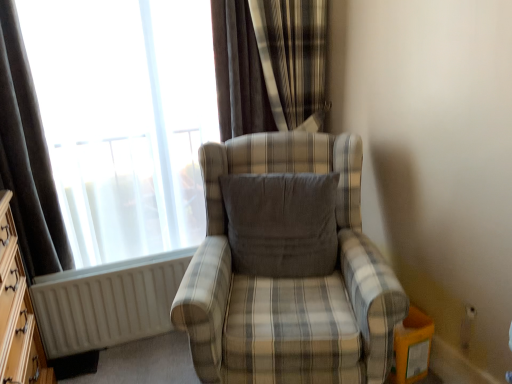
The height and width of the screenshot is (384, 512). Describe the element at coordinates (270, 65) in the screenshot. I see `velvet-like brown curtain at upper center, which ranks as the second curtain in left-to-right order` at that location.

The image size is (512, 384). What are the coordinates of `dark fabric curtain at left, acting as the 1th curtain starting from the left` in the screenshot? It's located at (28, 157).

What do you see at coordinates (106, 302) in the screenshot?
I see `white matte radiator at lower left` at bounding box center [106, 302].

Measure the distance between point (231,291) and camera.

A distance of 1.74 meters exists between point (231,291) and camera.

What is the approximate width of gray fabric pillow at center?

8.17 inches.

Locate an element on the screen. This screenshot has height=384, width=512. velvet-like brown curtain at upper center, positioned as the first curtain in right-to-left order is located at coordinates (270, 65).

Which is farther, [251,197] or [291,57]?

The point [291,57] is more distant.

From a real-world perspective, is gray fabric pillow at center physically located above or below velvet-like brown curtain at upper center, positioned as the first curtain in right-to-left order?

gray fabric pillow at center is situated lower than velvet-like brown curtain at upper center, positioned as the first curtain in right-to-left order, in the real world.

Is gray fabric pillow at center in front of or behind velvet-like brown curtain at upper center, which ranks as the second curtain in left-to-right order, in the image?

In the image, gray fabric pillow at center appears in front of velvet-like brown curtain at upper center, which ranks as the second curtain in left-to-right order.

Based on the photo, would you consider matte glass window at upper left to be distant from gray fabric pillow at center?

matte glass window at upper left is near gray fabric pillow at center, not far away.

Who is more distant, matte glass window at upper left or gray fabric pillow at center?

matte glass window at upper left is more distant.

Does matte glass window at upper left have a greater width compared to gray fabric pillow at center?

No, matte glass window at upper left is not wider than gray fabric pillow at center.

Considering the positions of objects plaid fabric chair at center and dark fabric curtain at left, which ranks as the second curtain in right-to-left order, in the image provided, who is more to the right, plaid fabric chair at center or dark fabric curtain at left, which ranks as the second curtain in right-to-left order,?

plaid fabric chair at center.

Which is less distant, (307, 299) or (7, 168)?

Clearly, point (307, 299) is closer to the camera than point (7, 168).

Which of these two, plaid fabric chair at center or dark fabric curtain at left, acting as the 1th curtain starting from the left, is smaller?

dark fabric curtain at left, acting as the 1th curtain starting from the left.

From the image's perspective, is plaid fabric chair at center below dark fabric curtain at left, acting as the 1th curtain starting from the left?

Yes, from the image's perspective, plaid fabric chair at center is beneath dark fabric curtain at left, acting as the 1th curtain starting from the left.

Is matte glass window at upper left positioned far away from velvet-like brown curtain at upper center, which ranks as the second curtain in left-to-right order?

That's not correct — matte glass window at upper left is a little close to velvet-like brown curtain at upper center, which ranks as the second curtain in left-to-right order.

Identify the location of window located below the velvet-like brown curtain at upper center, positioned as the first curtain in right-to-left order (from the image's perspective). (141, 113).

Could you tell me if matte glass window at upper left is facing velvet-like brown curtain at upper center, positioned as the first curtain in right-to-left order?

No, matte glass window at upper left is not oriented towards velvet-like brown curtain at upper center, positioned as the first curtain in right-to-left order.

How different are the orientations of matte glass window at upper left and velvet-like brown curtain at upper center, positioned as the first curtain in right-to-left order, in degrees?

matte glass window at upper left and velvet-like brown curtain at upper center, positioned as the first curtain in right-to-left order, are facing 0.787 degrees away from each other.

Considering the positions of points (254, 39) and (151, 117), is point (254, 39) closer to camera compared to point (151, 117)?

Yes, point (254, 39) is closer to viewer.

Is velvet-like brown curtain at upper center, positioned as the first curtain in right-to-left order, aimed at matte glass window at upper left?

No, velvet-like brown curtain at upper center, positioned as the first curtain in right-to-left order, is not turned towards matte glass window at upper left.

Is the position of velvet-like brown curtain at upper center, which ranks as the second curtain in left-to-right order, less distant than that of matte glass window at upper left?

No, the depth of velvet-like brown curtain at upper center, which ranks as the second curtain in left-to-right order, is greater than that of matte glass window at upper left.

Is point (4, 338) farther from camera compared to point (161, 275)?

No.

In the scene shown: Which object is positioned more to the right, wooden dresser at left or white matte radiator at lower left?

white matte radiator at lower left.

How distant is wooden dresser at left from white matte radiator at lower left?

wooden dresser at left and white matte radiator at lower left are 13.28 inches apart from each other.

Is wooden dresser at left turned away from white matte radiator at lower left?

No, wooden dresser at left is not facing the opposite direction of white matte radiator at lower left.

Considering the points (292, 184) and (19, 187), which point is in front, point (292, 184) or point (19, 187)?

The point (292, 184) is closer.

Which object is positioned more to the right, gray fabric pillow at center or dark fabric curtain at left, which ranks as the second curtain in right-to-left order?

From the viewer's perspective, gray fabric pillow at center appears more on the right side.

Is gray fabric pillow at center closer to camera compared to dark fabric curtain at left, acting as the 1th curtain starting from the left?

No, gray fabric pillow at center is behind dark fabric curtain at left, acting as the 1th curtain starting from the left.

Considering the relative sizes of gray fabric pillow at center and dark fabric curtain at left, acting as the 1th curtain starting from the left, in the image provided, is gray fabric pillow at center wider than dark fabric curtain at left, acting as the 1th curtain starting from the left,?

Indeed, gray fabric pillow at center has a greater width compared to dark fabric curtain at left, acting as the 1th curtain starting from the left.

Identify the location of curtain behind the gray fabric pillow at center. (270, 65).

Locate an element on the screen. The image size is (512, 384). window that appears above the gray fabric pillow at center (from a real-world perspective) is located at coordinates (141, 113).

Considering their positions, is plaid fabric chair at center positioned further to dark fabric curtain at left, acting as the 1th curtain starting from the left, than wooden dresser at left?

Among the two, plaid fabric chair at center is located further to dark fabric curtain at left, acting as the 1th curtain starting from the left.

Considering their positions, is velvet-like brown curtain at upper center, positioned as the first curtain in right-to-left order, positioned closer to plaid fabric chair at center than matte glass window at upper left?

velvet-like brown curtain at upper center, positioned as the first curtain in right-to-left order.

Based on their spatial positions, is velvet-like brown curtain at upper center, positioned as the first curtain in right-to-left order, or gray fabric pillow at center closer to dark fabric curtain at left, which ranks as the second curtain in right-to-left order?

gray fabric pillow at center is positioned closer to the anchor dark fabric curtain at left, which ranks as the second curtain in right-to-left order.

Consider the image. When comparing their distances from plaid fabric chair at center, does gray fabric pillow at center or white matte radiator at lower left seem closer?

gray fabric pillow at center lies closer to plaid fabric chair at center than the other object.

Based on their spatial positions, is gray fabric pillow at center or velvet-like brown curtain at upper center, which ranks as the second curtain in left-to-right order, further from plaid fabric chair at center?

velvet-like brown curtain at upper center, which ranks as the second curtain in left-to-right order, is further to plaid fabric chair at center.

From the image, which object appears to be nearer to gray fabric pillow at center, plaid fabric chair at center or matte glass window at upper left?

Among the two, plaid fabric chair at center is located nearer to gray fabric pillow at center.

Based on the photo, considering their positions, is wooden dresser at left positioned further to velvet-like brown curtain at upper center, positioned as the first curtain in right-to-left order, than white matte radiator at lower left?

Among the two, wooden dresser at left is located further to velvet-like brown curtain at upper center, positioned as the first curtain in right-to-left order.

When comparing their distances from gray fabric pillow at center, does velvet-like brown curtain at upper center, positioned as the first curtain in right-to-left order, or white matte radiator at lower left seem further?

white matte radiator at lower left.

The image size is (512, 384). I want to click on window between velvet-like brown curtain at upper center, positioned as the first curtain in right-to-left order, and white matte radiator at lower left from top to bottom, so click(141, 113).

Locate an element on the screen. This screenshot has height=384, width=512. radiator between wooden dresser at left and plaid fabric chair at center in the horizontal direction is located at coordinates (106, 302).

This screenshot has height=384, width=512. I want to click on pillow between matte glass window at upper left and plaid fabric chair at center from left to right, so click(x=281, y=224).

What are the coordinates of `curtain between matte glass window at upper left and white matte radiator at lower left in the vertical direction` in the screenshot? It's located at (28, 157).